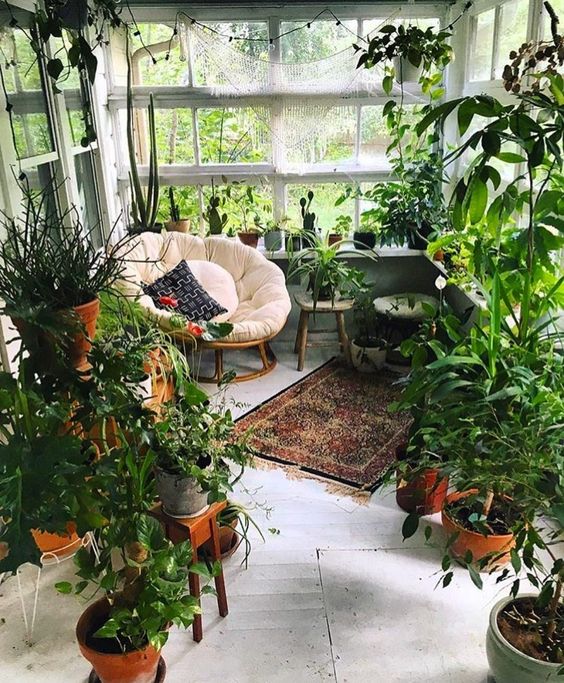
Where is `cushion`? The image size is (564, 683). cushion is located at coordinates (215, 279), (186, 304), (406, 313).